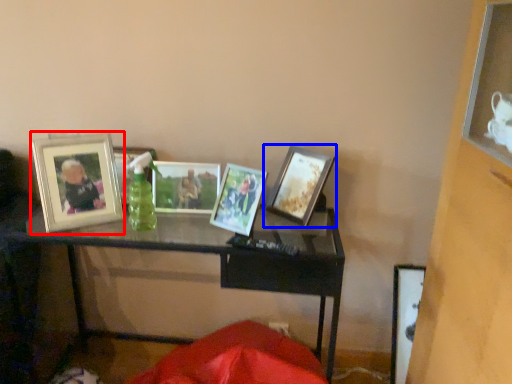
Question: Which object is further to the camera taking this photo, picture frame (highlighted by a red box) or picture frame (highlighted by a blue box)?

Choices:
 (A) picture frame
 (B) picture frame

Answer: (B)